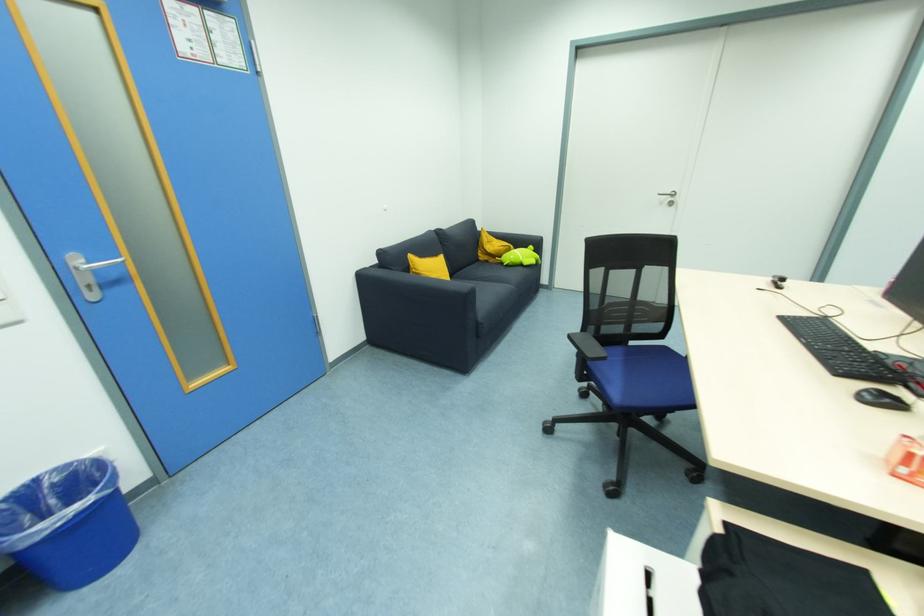
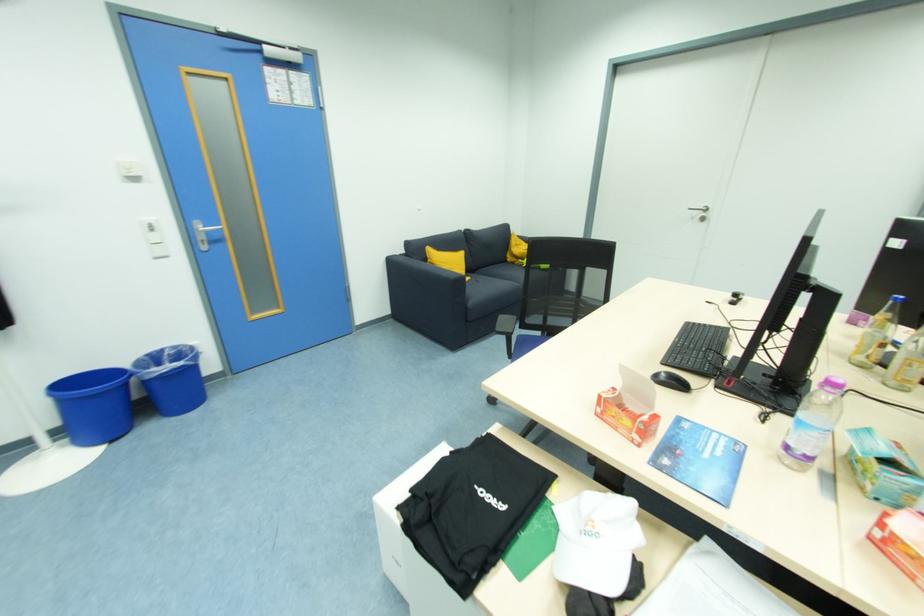
In the second image, find the point that corresponds to (x=675, y=205) in the first image.

(706, 221)